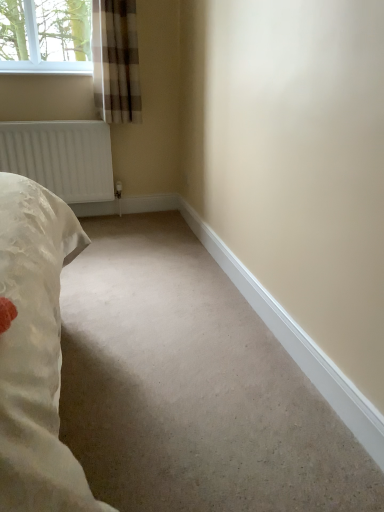
Question: In the image, is plaid fabric curtain at upper left positioned in front of or behind white matte radiator at left?

Choices:
 (A) front
 (B) behind

Answer: (A)

Question: Considering the positions of plaid fabric curtain at upper left and white matte radiator at left in the image, is plaid fabric curtain at upper left taller or shorter than white matte radiator at left?

Choices:
 (A) tall
 (B) short

Answer: (A)

Question: Is plaid fabric curtain at upper left inside or outside of white matte radiator at left?

Choices:
 (A) inside
 (B) outside

Answer: (B)

Question: In terms of height, does white matte radiator at left look taller or shorter compared to plaid fabric curtain at upper left?

Choices:
 (A) tall
 (B) short

Answer: (B)

Question: Is white matte radiator at left to the left or to the right of plaid fabric curtain at upper left in the image?

Choices:
 (A) right
 (B) left

Answer: (B)

Question: In terms of width, does white matte radiator at left look wider or thinner when compared to plaid fabric curtain at upper left?

Choices:
 (A) wide
 (B) thin

Answer: (B)

Question: From a real-world perspective, relative to plaid fabric curtain at upper left, is white matte radiator at left vertically above or below?

Choices:
 (A) above
 (B) below

Answer: (B)